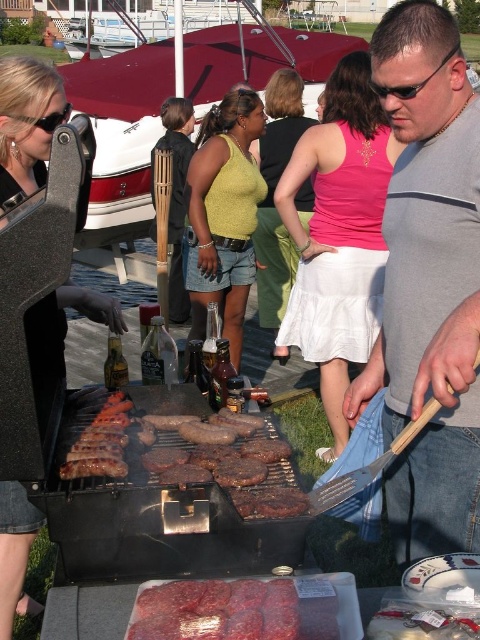
Is brown charred meat at center bigger than dark red raw meat at center?

Yes.

Can you confirm if brown charred meat at center is shorter than dark red raw meat at center?

No.

Who is more forward, [130,435] or [210,604]?

Point [210,604] is more forward.

Where is `brown charred meat at center`? brown charred meat at center is located at coordinates (188, 456).

Who is higher up, pink fabric skirt at center or green knit tank top at center?

green knit tank top at center is higher up.

Can you confirm if pink fabric skirt at center is bigger than green knit tank top at center?

Correct, pink fabric skirt at center is larger in size than green knit tank top at center.

Who is more forward, (369, 97) or (267, 314)?

Point (369, 97) is in front.

You are a GUI agent. You are given a task and a screenshot of the screen. Output one action in this format:
    pyautogui.click(x=<x>, y=<y>)
    Task: Click on the pink fabric skirt at center
    
    Given the screenshot: What is the action you would take?
    pyautogui.click(x=338, y=234)

Is matte black grill at left shorter than dark red raw meat at center?

In fact, matte black grill at left may be taller than dark red raw meat at center.

Does matte black grill at left come behind dark red raw meat at center?

Yes, matte black grill at left is behind dark red raw meat at center.

Is point (24, 492) less distant than point (302, 602)?

No.

Find the location of a particular element. matte black grill at left is located at coordinates (26, 124).